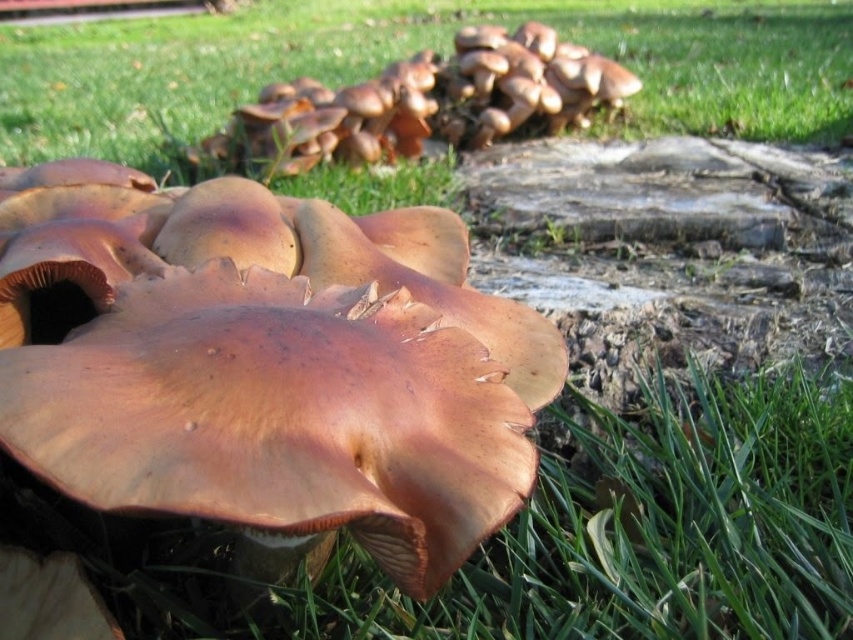
Question: Is brown matte fungi at center wider than brown grass at center?

Choices:
 (A) no
 (B) yes

Answer: (A)

Question: Is the position of brown matte fungi at center more distant than that of brown grass at center?

Choices:
 (A) no
 (B) yes

Answer: (A)

Question: Which is farther from the brown matte fungi at center?

Choices:
 (A) brown matte mushrooms at upper center
 (B) brown grass at center

Answer: (B)

Question: Which point appears farthest from the camera in this image?

Choices:
 (A) (279, 132)
 (B) (273, 301)
 (C) (790, 125)

Answer: (C)

Question: Is brown matte fungi at center positioned at the back of brown matte mushrooms at upper center?

Choices:
 (A) yes
 (B) no

Answer: (B)

Question: Which object appears closest to the camera in this image?

Choices:
 (A) brown matte mushrooms at upper center
 (B) brown matte fungi at center
 (C) brown grass at center

Answer: (B)